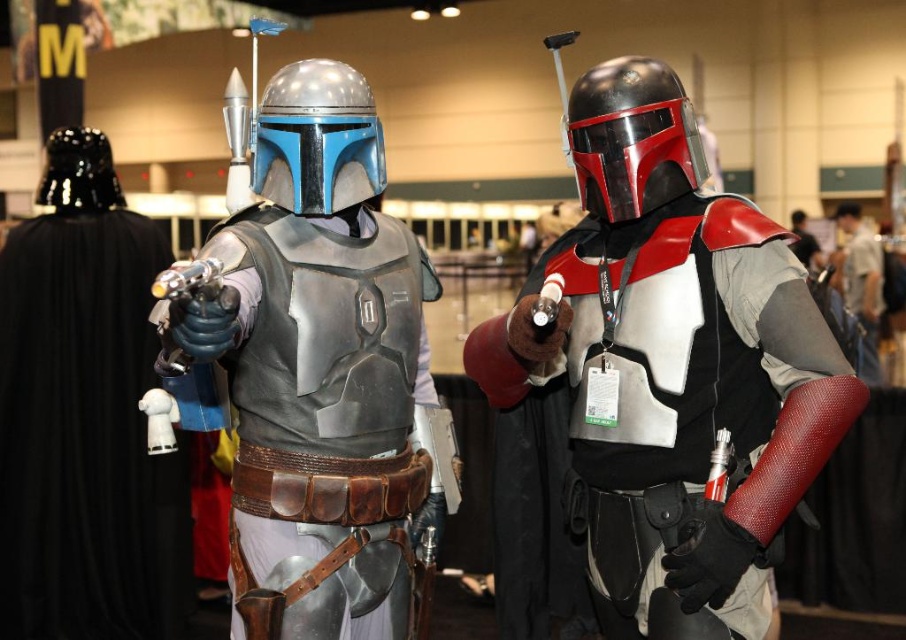
Between metallic silver armor at center and shiny black helmet at center, which one is positioned lower?

metallic silver armor at center is lower down.

Can you confirm if metallic silver armor at center is positioned above shiny black helmet at center?

Incorrect, metallic silver armor at center is not positioned above shiny black helmet at center.

Is point (389, 433) farther from camera compared to point (688, 113)?

No, it is not.

I want to click on metallic silver armor at center, so click(317, 371).

Does shiny black helmet at center have a greater width compared to metallic silver helmet at center?

Yes, shiny black helmet at center is wider than metallic silver helmet at center.

Does shiny black helmet at center appear over metallic silver helmet at center?

Correct, shiny black helmet at center is located above metallic silver helmet at center.

Does point (661, 84) lie in front of point (310, 108)?

No, (661, 84) is further to viewer.

Where is `shiny black helmet at center`? The image size is (906, 640). shiny black helmet at center is located at coordinates (631, 138).

Does shiny red armor at center come behind shiny black helmet at center?

No, shiny red armor at center is in front of shiny black helmet at center.

Between shiny red armor at center and shiny black helmet at center, which one is positioned higher?

shiny black helmet at center is higher up.

Locate an element on the screen. The height and width of the screenshot is (640, 906). shiny red armor at center is located at coordinates (671, 356).

Find the location of a particular element. The width and height of the screenshot is (906, 640). shiny red armor at center is located at coordinates (671, 356).